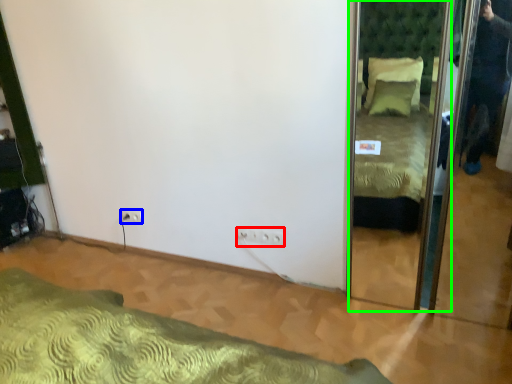
Question: Which object is the closest to the electric outlet (highlighted by a red box)? Choose among these: electric outlet (highlighted by a blue box) or mirror (highlighted by a green box).

Choices:
 (A) electric outlet
 (B) mirror

Answer: (A)